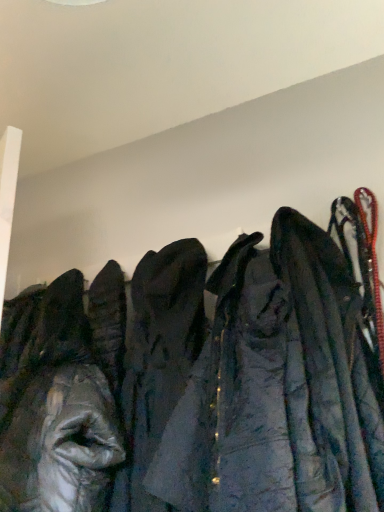
Question: Considering the relative sizes of dark gray fabric coat at center, which appears as the 1th cloak when viewed from the left, and dark blue fabric coat at right, which is counted as the second cloak, starting from the left, in the image provided, is dark gray fabric coat at center, which appears as the 1th cloak when viewed from the left, wider than dark blue fabric coat at right, which is counted as the second cloak, starting from the left,?

Choices:
 (A) no
 (B) yes

Answer: (A)

Question: Is dark gray fabric coat at center, which appears as the 1th cloak when viewed from the left, far from dark blue fabric coat at right, which is counted as the second cloak, starting from the left?

Choices:
 (A) yes
 (B) no

Answer: (B)

Question: Is dark gray fabric coat at center, which is the second cloak from right to left, touching dark blue fabric coat at right, which is counted as the second cloak, starting from the left?

Choices:
 (A) yes
 (B) no

Answer: (B)

Question: Does dark gray fabric coat at center, which appears as the 1th cloak when viewed from the left, come behind dark blue fabric coat at right, which is the 1th cloak in right-to-left order?

Choices:
 (A) yes
 (B) no

Answer: (A)

Question: From the image's perspective, would you say dark gray fabric coat at center, which appears as the 1th cloak when viewed from the left, is positioned over dark blue fabric coat at right, which is counted as the second cloak, starting from the left?

Choices:
 (A) yes
 (B) no

Answer: (B)

Question: Is shiny silver jacket at left inside or outside of dark gray fabric coat at center, which appears as the 1th cloak when viewed from the left?

Choices:
 (A) outside
 (B) inside

Answer: (A)

Question: From a real-world perspective, is shiny silver jacket at left physically located above or below dark gray fabric coat at center, which appears as the 1th cloak when viewed from the left?

Choices:
 (A) above
 (B) below

Answer: (A)

Question: Based on their sizes in the image, would you say shiny silver jacket at left is bigger or smaller than dark gray fabric coat at center, which appears as the 1th cloak when viewed from the left?

Choices:
 (A) big
 (B) small

Answer: (A)

Question: Considering the positions of shiny silver jacket at left and dark gray fabric coat at center, which is the second cloak from right to left, in the image, is shiny silver jacket at left wider or thinner than dark gray fabric coat at center, which is the second cloak from right to left,?

Choices:
 (A) wide
 (B) thin

Answer: (A)

Question: In terms of width, does dark gray fabric coat at center, which appears as the 1th cloak when viewed from the left, look wider or thinner when compared to dark blue fabric coat at right, which is the 1th cloak in right-to-left order?

Choices:
 (A) thin
 (B) wide

Answer: (A)

Question: From the image's perspective, is dark gray fabric coat at center, which appears as the 1th cloak when viewed from the left, located above or below dark blue fabric coat at right, which is the 1th cloak in right-to-left order?

Choices:
 (A) above
 (B) below

Answer: (B)

Question: Considering the positions of point (142, 355) and point (350, 456), is point (142, 355) closer or farther from the camera than point (350, 456)?

Choices:
 (A) closer
 (B) farther

Answer: (B)

Question: From a real-world perspective, is dark gray fabric coat at center, which appears as the 1th cloak when viewed from the left, positioned above or below dark blue fabric coat at right, which is counted as the second cloak, starting from the left?

Choices:
 (A) below
 (B) above

Answer: (A)

Question: In terms of height, does shiny silver jacket at left look taller or shorter compared to dark blue fabric coat at right, which is counted as the second cloak, starting from the left?

Choices:
 (A) tall
 (B) short

Answer: (B)

Question: From the image's perspective, is shiny silver jacket at left positioned above or below dark blue fabric coat at right, which is counted as the second cloak, starting from the left?

Choices:
 (A) above
 (B) below

Answer: (B)